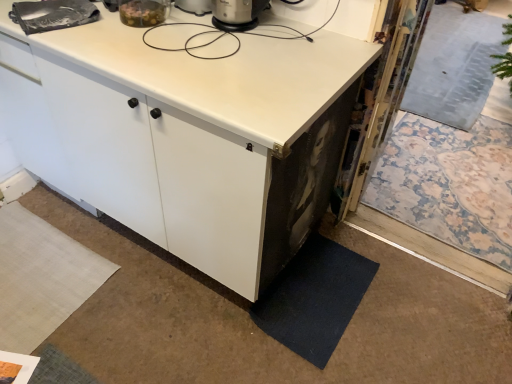
Question: Would you say dark blue carpet at lower right is a long distance from white matte countertop at upper center?

Choices:
 (A) yes
 (B) no

Answer: (B)

Question: Is white matte countertop at upper center a part of dark blue carpet at lower right?

Choices:
 (A) no
 (B) yes

Answer: (A)

Question: Considering the relative sizes of dark blue carpet at lower right and white matte countertop at upper center in the image provided, is dark blue carpet at lower right wider than white matte countertop at upper center?

Choices:
 (A) yes
 (B) no

Answer: (B)

Question: Is dark blue carpet at lower right bigger than white matte countertop at upper center?

Choices:
 (A) yes
 (B) no

Answer: (B)

Question: Does dark blue carpet at lower right have a lesser height compared to white matte countertop at upper center?

Choices:
 (A) no
 (B) yes

Answer: (B)

Question: Is dark blue carpet at lower right located outside white matte countertop at upper center?

Choices:
 (A) yes
 (B) no

Answer: (A)

Question: Is white matte countertop at upper center not close to dark blue carpet at lower right?

Choices:
 (A) yes
 (B) no

Answer: (B)

Question: Considering the relative sizes of white matte countertop at upper center and dark blue carpet at lower right in the image provided, is white matte countertop at upper center wider than dark blue carpet at lower right?

Choices:
 (A) no
 (B) yes

Answer: (B)

Question: From the image's perspective, is white matte countertop at upper center above dark blue carpet at lower right?

Choices:
 (A) no
 (B) yes

Answer: (B)

Question: Considering the relative sizes of white matte countertop at upper center and dark blue carpet at lower right in the image provided, is white matte countertop at upper center smaller than dark blue carpet at lower right?

Choices:
 (A) no
 (B) yes

Answer: (A)

Question: Can you confirm if white matte countertop at upper center is thinner than dark blue carpet at lower right?

Choices:
 (A) no
 (B) yes

Answer: (A)

Question: Would you say white matte countertop at upper center is outside dark blue carpet at lower right?

Choices:
 (A) no
 (B) yes

Answer: (B)

Question: Is white matte cabinet at center completely or partially outside of white matte countertop at upper center?

Choices:
 (A) no
 (B) yes

Answer: (B)